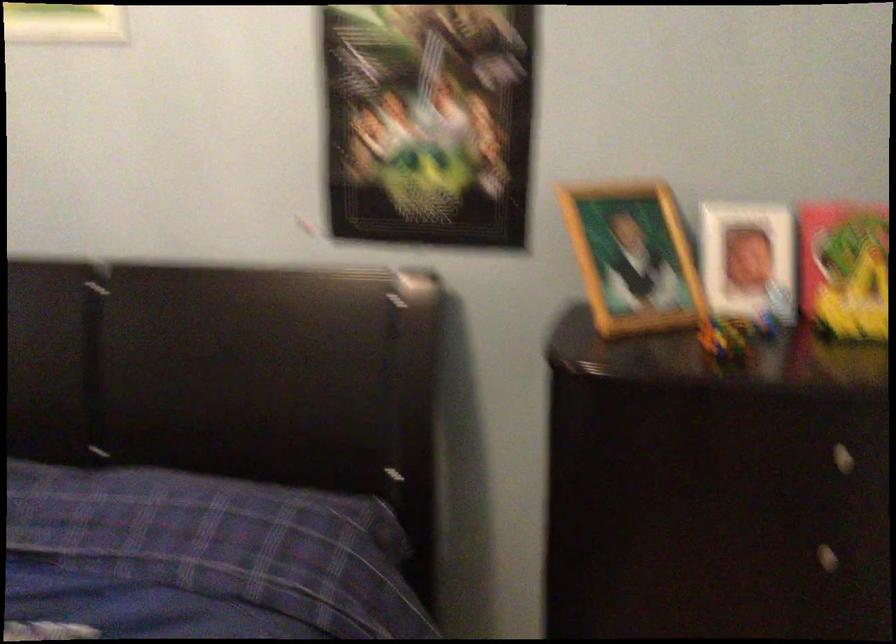
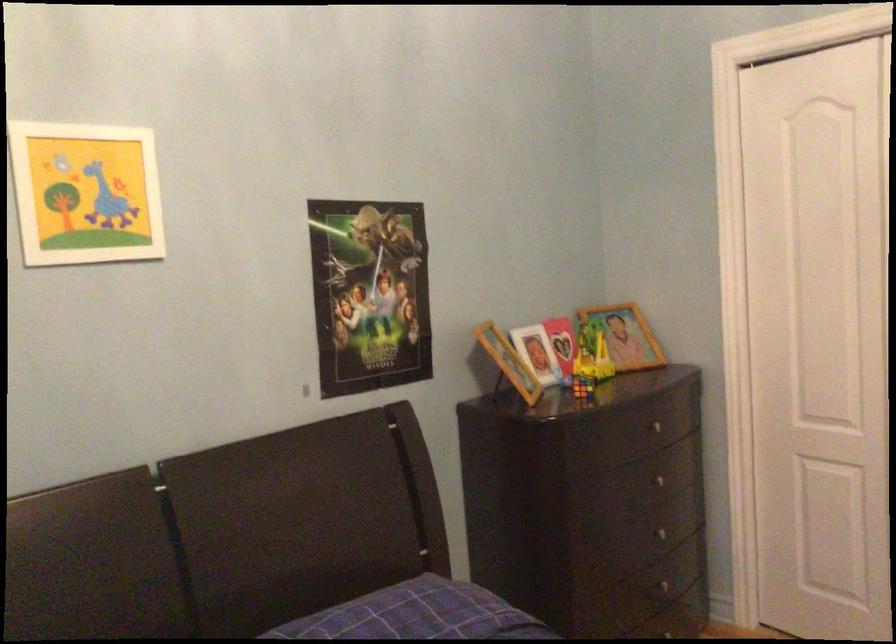
Find the pixel in the second image that matches (426,122) in the first image.

(369, 294)